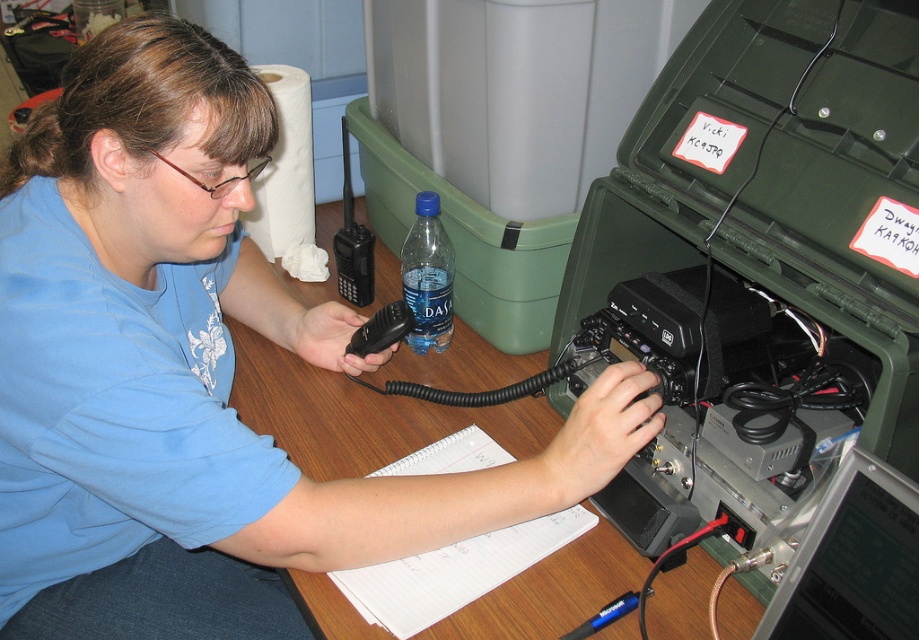
You are an electrician trying to fix a malfunctioning device. You have two devices on the desk, the matte black radio at center and the black plastic handheld radio at center. Which device is taller?

The matte black radio at center is much taller than the black plastic handheld radio at center.

Looking at this image, you are an office worker who needs to reach for the matte black radio at center and the black plastic handheld radio at center during a phone call. Which one is located higher on the desk?

The matte black radio at center is located higher than the black plastic handheld radio at center because it is positioned above it.